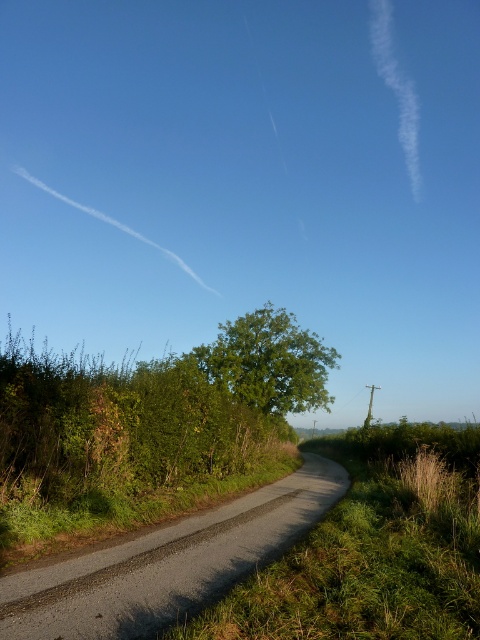
You are standing at the edge of the gravel road at center and looking towards the green leafy tree at center. Which direction should you walk to reach the tree without crossing the road?

The gravel road at center is positioned under the green leafy tree at center, so you should walk forward along the gravel road at center towards the tree since it is directly ahead of you.

You need to drive a car that is 2 meters wide through the gravel road at center. Can the car pass through the road if the green leafy tree at center is blocking part of the road?

The gravel road at center is narrower than the green leafy tree at center, so the car cannot pass through the road as it is too narrow and the tree may be blocking part of it.